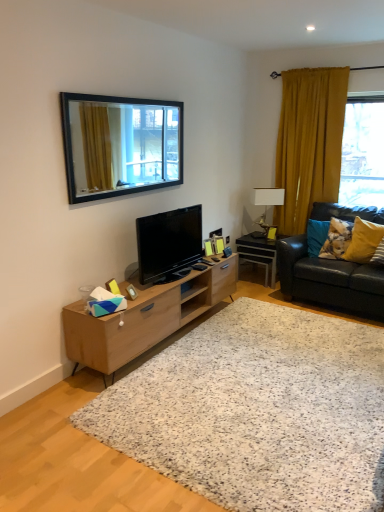
I want to click on transparent glass window at right, so click(x=363, y=152).

What are the coordinates of `mustard velvet curtain at right` in the screenshot? It's located at (309, 143).

What do you see at coordinates (309, 143) in the screenshot? I see `mustard velvet curtain at right` at bounding box center [309, 143].

In order to face matte black tv at center, should I rotate leftwards or rightwards?

Rotate left and turn 3.095 degrees.

What is the approximate height of matte black tv at center?

The height of matte black tv at center is 22.22 inches.

Image resolution: width=384 pixels, height=512 pixels. In order to click on black plastic remote control at lower center in this screenshot , I will do `click(199, 266)`.

Identify the location of black framed mirror at upper center. (120, 145).

Locate an element on the screen. black glossy desk at right is located at coordinates (259, 254).

Which is farther from the camera, (281, 283) or (367, 243)?

Point (281, 283)

From their relative heights in the image, would you say black leather couch at right is taller or shorter than yellow fabric pillow at right, placed as the 1th pillow when sorted from right to left?

Clearly, black leather couch at right is taller compared to yellow fabric pillow at right, placed as the 1th pillow when sorted from right to left.

Where is `studio couch that is under the yellow fabric pillow at right, marked as the second pillow in a left-to-right arrangement (from a real-world perspective)`? The width and height of the screenshot is (384, 512). studio couch that is under the yellow fabric pillow at right, marked as the second pillow in a left-to-right arrangement (from a real-world perspective) is located at coordinates (329, 280).

From a real-world perspective, is black framed mirror at upper center beneath matte black tv at center?

No, from a real-world perspective, black framed mirror at upper center is not under matte black tv at center.

Looking at this image, which object is wider, black framed mirror at upper center or matte black tv at center?

matte black tv at center.

Could you tell me if black framed mirror at upper center is turned towards matte black tv at center?

No, black framed mirror at upper center is not facing towards matte black tv at center.

Is black framed mirror at upper center positioned beyond the bounds of matte black tv at center?

black framed mirror at upper center lies outside matte black tv at center's area.

What's the angular difference between black plastic remote control at lower center and yellow fabric pillow at right, marked as the second pillow in a left-to-right arrangement,'s facing directions?

The angle between the facing direction of black plastic remote control at lower center and the facing direction of yellow fabric pillow at right, marked as the second pillow in a left-to-right arrangement, is 94.2 degrees.

The image size is (384, 512). What are the coordinates of `remote control on the left of yellow fabric pillow at right, placed as the 1th pillow when sorted from right to left` in the screenshot? It's located at (199, 266).

How far apart are black plastic remote control at lower center and yellow fabric pillow at right, marked as the second pillow in a left-to-right arrangement?

Answer: A distance of 1.56 meters exists between black plastic remote control at lower center and yellow fabric pillow at right, marked as the second pillow in a left-to-right arrangement.

Which of these two, black plastic remote control at lower center or yellow fabric pillow at right, marked as the second pillow in a left-to-right arrangement, is wider?

A: yellow fabric pillow at right, marked as the second pillow in a left-to-right arrangement, is wider.

How distant is black leather couch at right from black plastic remote control at lower center?

A distance of 1.22 meters exists between black leather couch at right and black plastic remote control at lower center.

Is black leather couch at right surrounding black plastic remote control at lower center?

Actually, black plastic remote control at lower center is outside black leather couch at right.

Could you tell me if black leather couch at right is facing black plastic remote control at lower center?

Yes, black leather couch at right faces towards black plastic remote control at lower center.

From the image's perspective, does black leather couch at right appear lower than black plastic remote control at lower center?

Incorrect, from the image's perspective, black leather couch at right is higher than black plastic remote control at lower center.

Who is shorter, light wood/finish tv stand at center or black framed mirror at upper center?

With less height is light wood/finish tv stand at center.

How many degrees apart are the facing directions of light wood/finish tv stand at center and black framed mirror at upper center?

0.682 degrees separate the facing orientations of light wood/finish tv stand at center and black framed mirror at upper center.

Can you confirm if light wood/finish tv stand at center is thinner than black framed mirror at upper center?

No, light wood/finish tv stand at center is not thinner than black framed mirror at upper center.

How different are the orientations of transparent glass window at right and matte black tv at center in degrees?

The angle between the facing direction of transparent glass window at right and the facing direction of matte black tv at center is 88.4 degrees.

Is transparent glass window at right inside or outside of matte black tv at center?

transparent glass window at right is spatially situated outside matte black tv at center.

Is point (382, 159) positioned after point (143, 265)?

Yes.

Are transparent glass window at right and matte black tv at center making contact?

No, transparent glass window at right is not beside matte black tv at center.

Is wooden picture frame at center positioned before black plastic remote control at lower center?

Yes, the depth of wooden picture frame at center is less than that of black plastic remote control at lower center.

From the image's perspective, relative to black plastic remote control at lower center, is wooden picture frame at center above or below?

From the image's perspective, wooden picture frame at center appears below black plastic remote control at lower center.

Does wooden picture frame at center touch black plastic remote control at lower center?

wooden picture frame at center is not next to black plastic remote control at lower center, and they're not touching.

What are the coordinates of `the 1st pillow positioned above the black leather couch at right (from the image's perspective)` in the screenshot? It's located at (363, 241).

Where is `mirror located on the left of matte black tv at center`? mirror located on the left of matte black tv at center is located at coordinates (120, 145).

Looking at the image, which one is located closer to transparent glass window at right, white speckled rug at center or black plastic remote control at lower center?

Based on the image, black plastic remote control at lower center appears to be nearer to transparent glass window at right.

From the image, which object appears to be nearer to black plastic remote control at lower center, white ceramic lamp at right or black leather couch at right?

black leather couch at right lies closer to black plastic remote control at lower center than the other object.

Looking at the image, which one is located further to wooden picture frame at center, white speckled rug at center or black leather couch at right?

black leather couch at right.

Considering their positions, is black glossy desk at right positioned closer to white ceramic lamp at right than light wood/finish tv stand at center?

black glossy desk at right is positioned closer to the anchor white ceramic lamp at right.

Which object lies nearer to the anchor point black framed mirror at upper center, black leather couch at right or transparent glass window at right?

Based on the image, black leather couch at right appears to be nearer to black framed mirror at upper center.

Looking at the image, which one is located further to transparent glass window at right, yellow fabric pillow at right, placed as the 1th pillow when sorted from right to left, or wooden picture frame at center?

Among the two, wooden picture frame at center is located further to transparent glass window at right.

Which object lies further to the anchor point black plastic remote control at lower center, matte black tv at center or yellow fabric pillow at right, marked as the second pillow in a left-to-right arrangement?

Based on the image, yellow fabric pillow at right, marked as the second pillow in a left-to-right arrangement, appears to be further to black plastic remote control at lower center.

Looking at this image, looking at the image, which one is located closer to matte black tv at center, black framed mirror at upper center or light wood/finish tv stand at center?

light wood/finish tv stand at center lies closer to matte black tv at center than the other object.

You are a GUI agent. You are given a task and a screenshot of the screen. Output one action in this format:
    pyautogui.click(x=<x>, y=<y>)
    Task: Click on the desk located between black leather couch at right and white ceramic lamp at right in the depth direction
    
    Given the screenshot: What is the action you would take?
    pyautogui.click(x=259, y=254)

Locate an element on the screen. The width and height of the screenshot is (384, 512). plain situated between black framed mirror at upper center and black leather couch at right from left to right is located at coordinates (257, 411).

At what (x,y) coordinates should I click in order to perform the action: click on lamp between matte black tv at center and transparent glass window at right from left to right. Please return your answer as a coordinate pair (x, y). This screenshot has width=384, height=512. Looking at the image, I should click on (269, 197).

Identify the location of lamp between black framed mirror at upper center and yellow fabric pillow at right, placed as the 1th pillow when sorted from right to left. This screenshot has width=384, height=512. (269, 197).